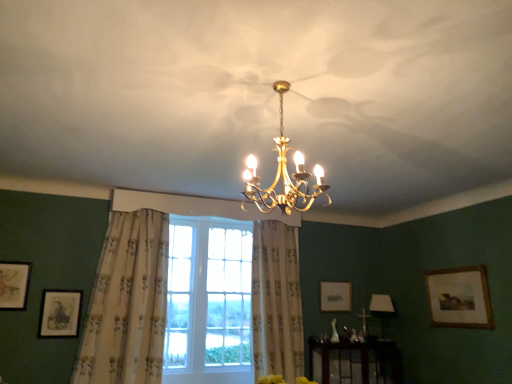
Question: From a real-world perspective, is matte gold picture frame at lower left, which is the 2th picture frame in front-to-back order, physically below wooden framed painting at right, which is the 4th picture frame from left to right?

Choices:
 (A) no
 (B) yes

Answer: (B)

Question: Considering the relative sizes of matte gold picture frame at lower left, the 2th picture frame positioned from the left, and wooden framed painting at right, which appears as the first picture frame when viewed from the right, in the image provided, is matte gold picture frame at lower left, the 2th picture frame positioned from the left, shorter than wooden framed painting at right, which appears as the first picture frame when viewed from the right,?

Choices:
 (A) yes
 (B) no

Answer: (A)

Question: From a real-world perspective, is matte gold picture frame at lower left, placed as the third picture frame when sorted from back to front, on wooden framed painting at right, the second picture frame from the back?

Choices:
 (A) yes
 (B) no

Answer: (B)

Question: Is matte gold picture frame at lower left, arranged as the third picture frame when viewed from the right, bigger than wooden framed painting at right, which is the 4th picture frame from left to right?

Choices:
 (A) no
 (B) yes

Answer: (A)

Question: Is matte gold picture frame at lower left, the 2th picture frame positioned from the left, placed right next to wooden framed painting at right, the second picture frame from the back?

Choices:
 (A) no
 (B) yes

Answer: (A)

Question: From a real-world perspective, is white floral fabric curtain at left, arranged as the 2th curtain when viewed from the right, physically located above or below wooden framed painting at right, the second picture frame from the back?

Choices:
 (A) below
 (B) above

Answer: (B)

Question: Considering their positions, is white floral fabric curtain at left, arranged as the 2th curtain when viewed from the right, located in front of or behind wooden framed painting at right, the second picture frame from the back?

Choices:
 (A) front
 (B) behind

Answer: (A)

Question: Based on their positions, is white floral fabric curtain at left, arranged as the 1th curtain when viewed from the left, located to the left or right of wooden framed painting at right, which is the 4th picture frame from left to right?

Choices:
 (A) right
 (B) left

Answer: (B)

Question: Considering the positions of white floral fabric curtain at left, arranged as the 2th curtain when viewed from the right, and wooden framed painting at right, marked as the third picture frame in a front-to-back arrangement, in the image, is white floral fabric curtain at left, arranged as the 2th curtain when viewed from the right, taller or shorter than wooden framed painting at right, marked as the third picture frame in a front-to-back arrangement,?

Choices:
 (A) tall
 (B) short

Answer: (A)

Question: Is matte gold picture frame at lower left, arranged as the third picture frame when viewed from the right, situated inside clear glass window at center or outside?

Choices:
 (A) inside
 (B) outside

Answer: (B)

Question: Would you say matte gold picture frame at lower left, the 2th picture frame positioned from the left, is to the left or to the right of clear glass window at center in the picture?

Choices:
 (A) left
 (B) right

Answer: (A)

Question: Is matte gold picture frame at lower left, placed as the third picture frame when sorted from back to front, wider or thinner than clear glass window at center?

Choices:
 (A) wide
 (B) thin

Answer: (B)

Question: Is matte gold picture frame at lower left, placed as the third picture frame when sorted from back to front, taller or shorter than clear glass window at center?

Choices:
 (A) tall
 (B) short

Answer: (B)

Question: In the image, is clear glass window at center on the left side or the right side of gold metallic chandelier at center, the 2th lamp positioned from the back?

Choices:
 (A) left
 (B) right

Answer: (A)

Question: Is clear glass window at center in front of or behind gold metallic chandelier at center, which is the 1th lamp from top to bottom, in the image?

Choices:
 (A) front
 (B) behind

Answer: (B)